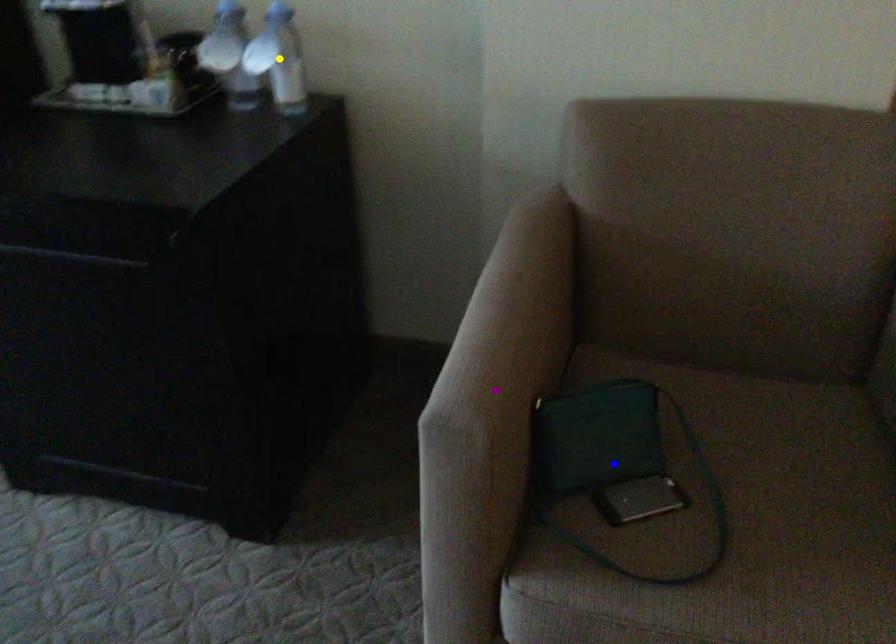
Order these from nearest to farthest:
yellow point | blue point | purple point

purple point, blue point, yellow point